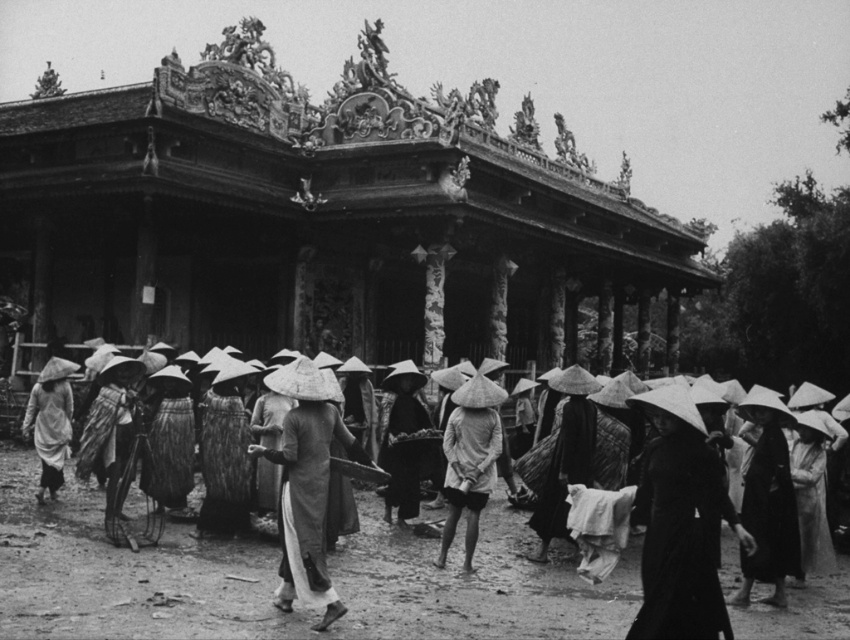
You are a photographer planning to take a group photo of the matte white conical hat at center and the matte gray robe at left. Which object should you place closer to the camera to ensure both appear the same size in the photo?

Since the matte white conical hat at center is smaller in width than the matte gray robe at left, you should place the matte white conical hat at center closer to the camera to make them appear the same size in the photo.

You are an anthropologist observing the scene and need to document the placement of the objects. Which object is located below the other between the matte white conical hat at center and the matte gray robe at left?

The matte white conical hat at center is positioned under the matte gray robe at left.

You are standing in front of the traditional building with intricate roof decorations. You notice a point marked at coordinates (275, 579). What object is located at that point?

The point at (275, 579) marks the location of the matte straw hat at center.